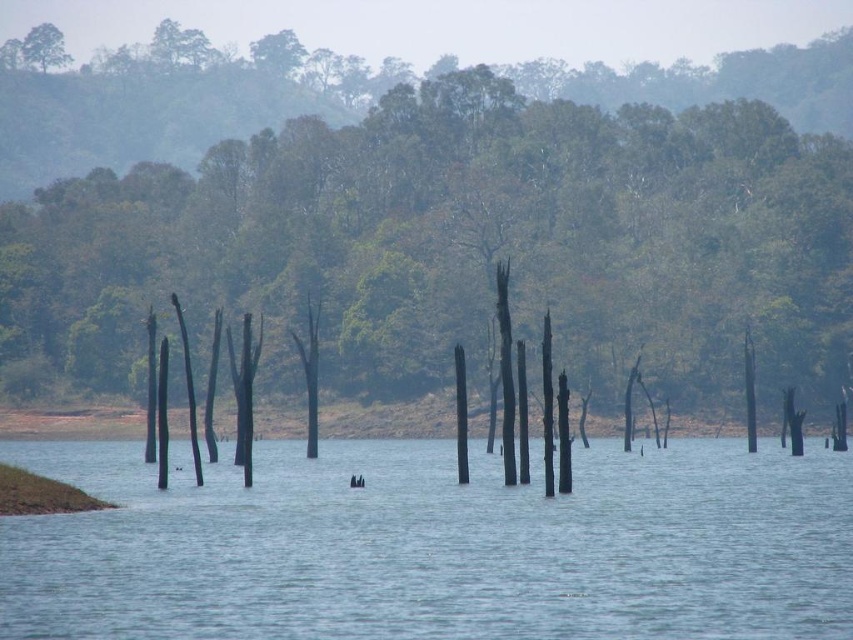
Question: Estimate the real-world distances between objects in this image. Which object is farther from the green matte tree at upper left?

Choices:
 (A) blue water at center
 (B) brown wood tree at center

Answer: (A)

Question: Which object appears farthest from the camera in this image?

Choices:
 (A) blue water at center
 (B) brown wood tree at center
 (C) green matte tree at upper left

Answer: (C)

Question: Which of the following is the closest to the observer?

Choices:
 (A) green matte tree at upper left
 (B) brown wood tree at center
 (C) blue water at center

Answer: (C)

Question: Is brown wood tree at center smaller than blue water at center?

Choices:
 (A) no
 (B) yes

Answer: (A)

Question: Can you confirm if brown wood tree at center is wider than green matte tree at upper left?

Choices:
 (A) yes
 (B) no

Answer: (A)

Question: Can you confirm if blue water at center is smaller than green matte tree at upper left?

Choices:
 (A) no
 (B) yes

Answer: (B)